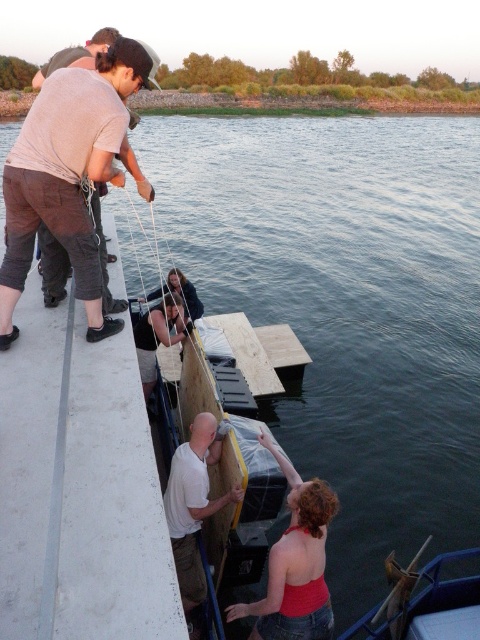
You are standing on the dock and need to locate the person wearing the red sleeveless top at lower right. According to the coordinates provided, where exactly should you look?

The red sleeveless top at lower right is located at point 0.883 on the x axis and 0.615 on the y axis.

You are a photographer trying to capture a candid shot of the two individuals wearing the red sleeveless top at lower right and the dark brown leather jacket at center. Since you want to ensure both subjects are in focus, you need to know which one is taller. Can you determine which person is taller?

The red sleeveless top at lower right has a greater height compared to the dark brown leather jacket at center, so the person wearing the red sleeveless top at lower right is taller.

Based on the photo, you are standing on the dock and notice two items at the lower right corner. Which one is positioned closer to the left side of the dock between the red sleeveless top at lower right and the wooden boat at lower right?

The red sleeveless top at lower right is positioned to the left of the wooden boat at lower right, so it is closer to the left side of the dock.